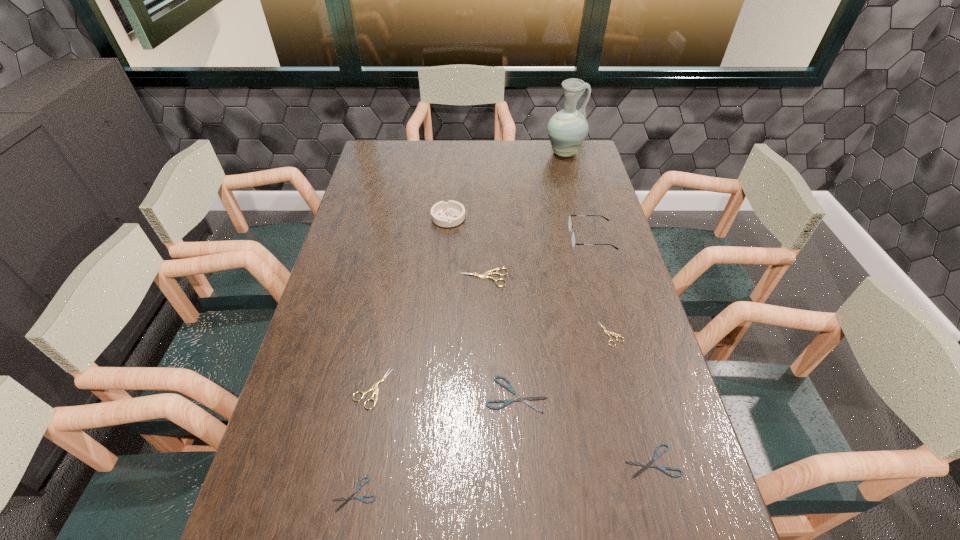
At what (x,y) coordinates should I click in order to perform the action: click on free location that satisfies the following two spatial constraints: 1. on the handle side of the tallest object; 2. on the back side of the second smallest black shears. Please return your answer as a coordinate pair (x, y). Looking at the image, I should click on (641, 461).

In order to click on free space that satisfies the following two spatial constraints: 1. on the front side of the second biggest black shears; 2. on the right side of the ashtray in this screenshot , I will do `click(429, 461)`.

I want to click on free spot that satisfies the following two spatial constraints: 1. on the lenses of the spectacles; 2. on the front side of the shortest object, so click(660, 494).

Identify the location of vacant space that satisfies the following two spatial constraints: 1. on the lenses of the black spectacles; 2. on the front side of the biggest black shears. The width and height of the screenshot is (960, 540). (634, 394).

You are a GUI agent. You are given a task and a screenshot of the screen. Output one action in this format:
    pyautogui.click(x=<x>, y=<y>)
    Task: Click on the vacant space that satisfies the following two spatial constraints: 1. on the back side of the shortest shears; 2. on the left side of the third tallest object
    The height and width of the screenshot is (540, 960).
    Given the screenshot: What is the action you would take?
    pyautogui.click(x=406, y=218)